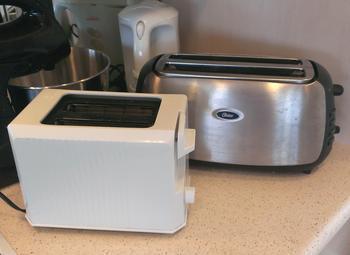
At what (x,y) coordinates should I click in order to perform the action: click on mixer. Please return your answer as a coordinate pair (x, y). Looking at the image, I should click on (40, 41).